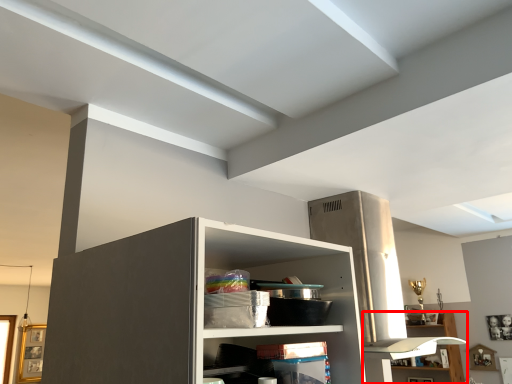
Question: Considering the relative positions of shelf (annotated by the red box) and shelf in the image provided, where is shelf (annotated by the red box) located with respect to the staircase?

Choices:
 (A) left
 (B) right

Answer: (B)